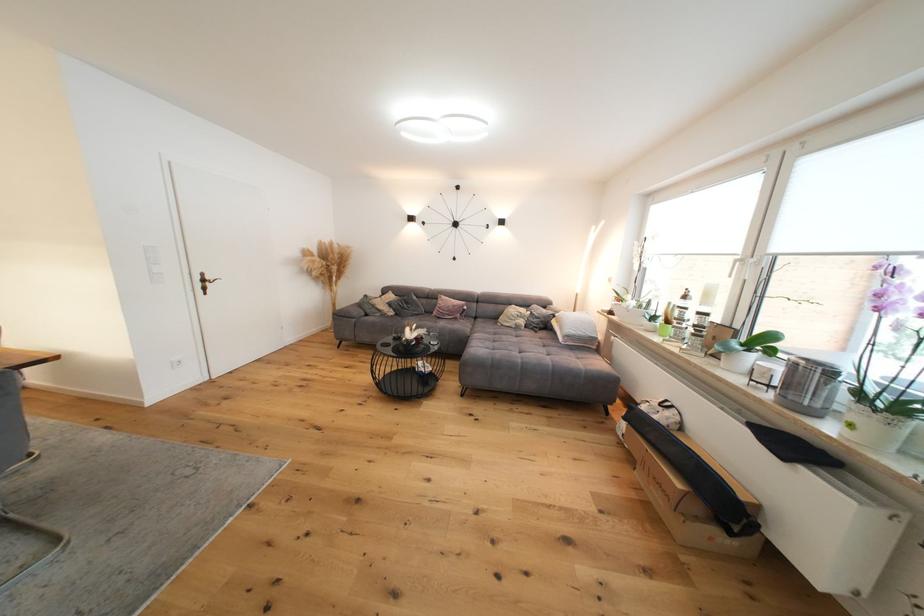
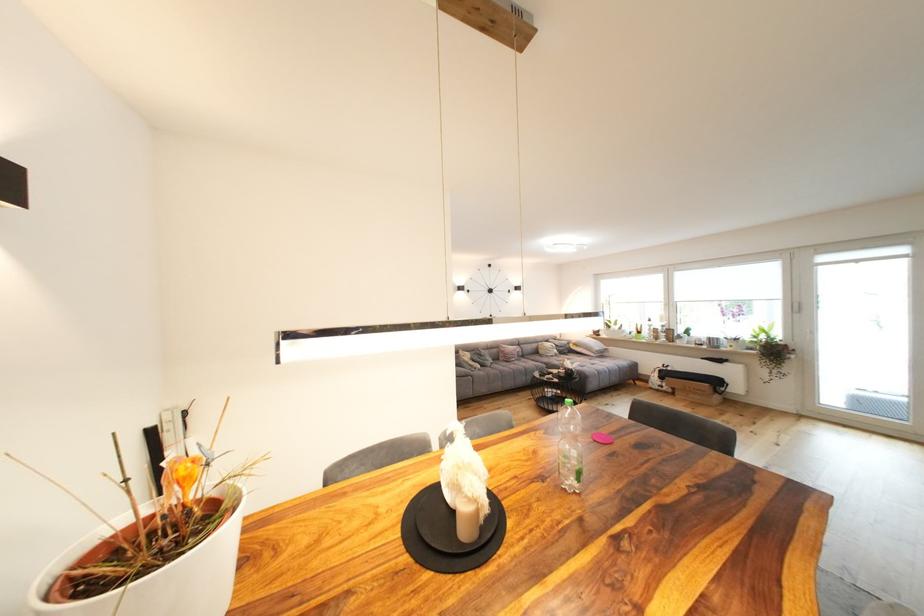
Locate, in the second image, the point that corresponds to (529,323) in the first image.

(563, 353)